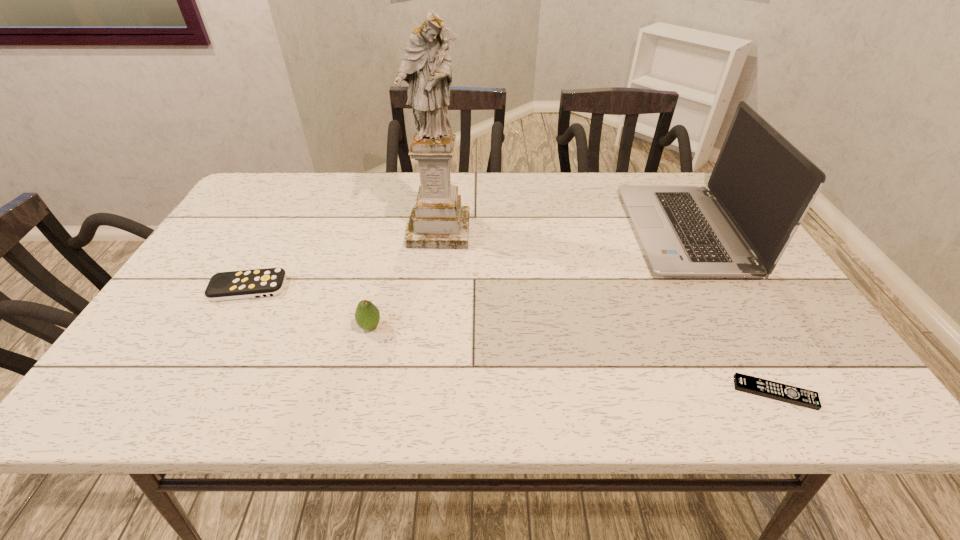
This screenshot has height=540, width=960. I want to click on object that stands as the second closest to the leftmost object, so click(x=438, y=221).

Find the location of a particular element. This screenshot has height=540, width=960. vacant area in the image that satisfies the following two spatial constraints: 1. on the screen of the nearest object; 2. on the right side of the laptop computer is located at coordinates (773, 393).

Find the location of `vacant space that satisfies the following two spatial constraints: 1. on the front-facing side of the tallest object; 2. on the left side of the shortest object`. vacant space that satisfies the following two spatial constraints: 1. on the front-facing side of the tallest object; 2. on the left side of the shortest object is located at coordinates pos(421,393).

Where is `blank space that satisfies the following two spatial constraints: 1. on the screen of the fourth shortest object; 2. on the left side of the shorter remote control`? Image resolution: width=960 pixels, height=540 pixels. blank space that satisfies the following two spatial constraints: 1. on the screen of the fourth shortest object; 2. on the left side of the shorter remote control is located at coordinates (773, 393).

Where is `free space that satisfies the following two spatial constraints: 1. on the screen of the laptop computer; 2. on the front side of the third shortest object`? The height and width of the screenshot is (540, 960). free space that satisfies the following two spatial constraints: 1. on the screen of the laptop computer; 2. on the front side of the third shortest object is located at coordinates (736, 327).